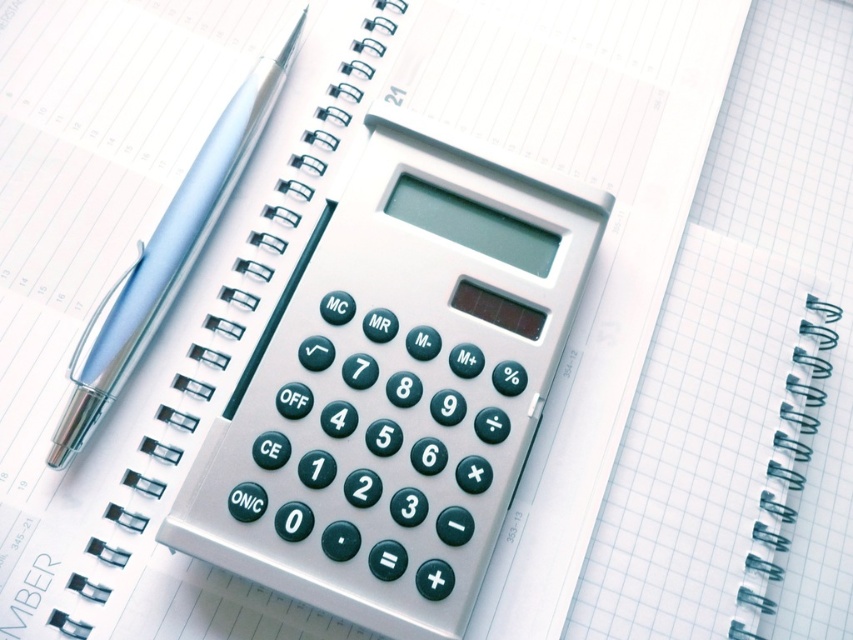
Question: Which object appears farthest from the camera in this image?

Choices:
 (A) silver/black calculator at center
 (B) silver metallic pen at left

Answer: (B)

Question: Does silver/black calculator at center have a larger size compared to silver metallic pen at left?

Choices:
 (A) yes
 (B) no

Answer: (A)

Question: Is silver/black calculator at center to the left of silver metallic pen at left from the viewer's perspective?

Choices:
 (A) no
 (B) yes

Answer: (A)

Question: Is silver/black calculator at center to the right of silver metallic pen at left from the viewer's perspective?

Choices:
 (A) yes
 (B) no

Answer: (A)

Question: Which point is farther from the camera taking this photo?

Choices:
 (A) (204, 474)
 (B) (247, 148)

Answer: (B)